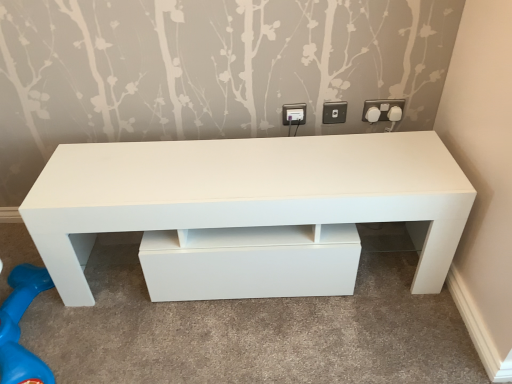
I want to click on free space above white glossy table at center (from a real-world perspective), so [246, 164].